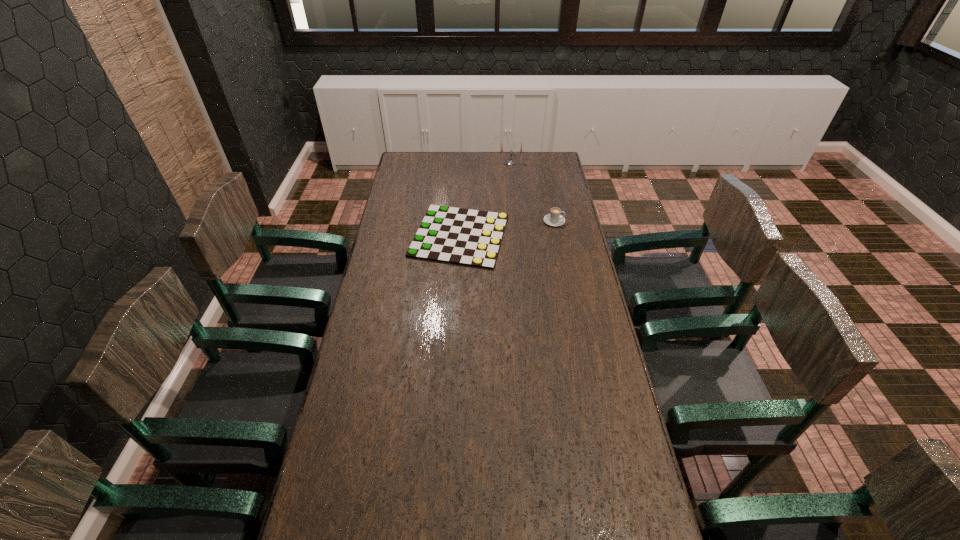
This screenshot has width=960, height=540. Find the location of `object that is the closest to the shortest object`. object that is the closest to the shortest object is located at coordinates (554, 218).

Select which object appears as the closest to the second shortest object. Please provide its 2D coordinates. Your answer should be formatted as a tuple, i.e. [(x, y)], where the tuple contains the x and y coordinates of a point satisfying the conditions above.

[(467, 237)]

Where is `blank area in the image that satisfies the following two spatial constraints: 1. to the right of the second tallest object; 2. on the front side of the shortest object`? blank area in the image that satisfies the following two spatial constraints: 1. to the right of the second tallest object; 2. on the front side of the shortest object is located at coordinates (557, 235).

Find the location of `free spot that satisfies the following two spatial constraints: 1. to the right of the second tallest object; 2. on the front side of the shortest object`. free spot that satisfies the following two spatial constraints: 1. to the right of the second tallest object; 2. on the front side of the shortest object is located at coordinates (557, 235).